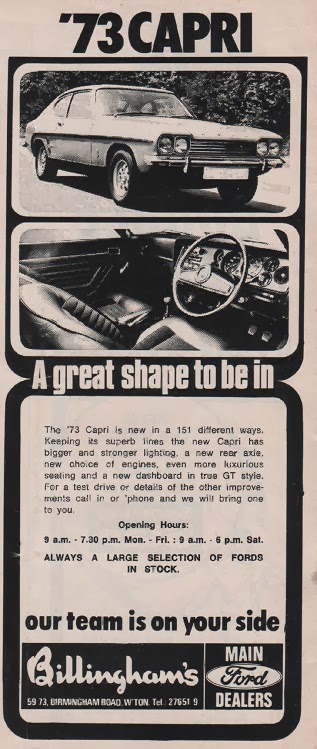
This screenshot has width=317, height=749. What are the coordinates of `door` in the screenshot? It's located at (72, 126).